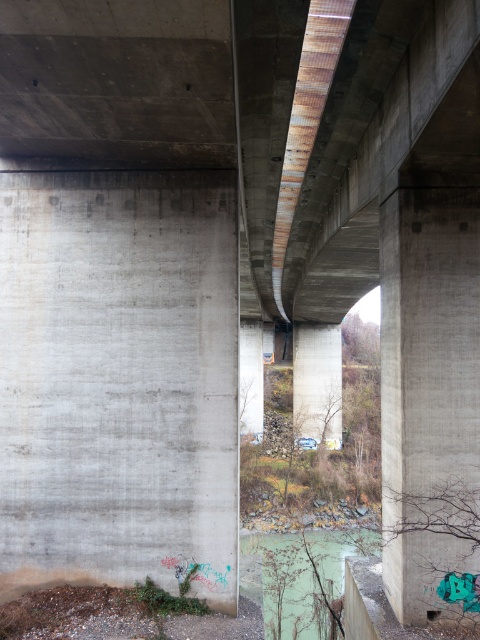
You are a GUI agent. You are given a task and a screenshot of the screen. Output one action in this format:
    pyautogui.click(x=<x>, y=<y>)
    Task: Click on the gray concrete wall at left
    
    Given the screenshot: What is the action you would take?
    pyautogui.click(x=119, y=378)

What are the coordinates of `gray concrete wall at left` in the screenshot? It's located at (119, 378).

Does gray concrete wall at left have a smaller size compared to gray concrete pillar at center?

Yes.

What are the coordinates of `gray concrete wall at left` in the screenshot? It's located at (119, 378).

At what (x,y) coordinates should I click in order to perform the action: click on gray concrete wall at left. Please return your answer as a coordinate pair (x, y). The height and width of the screenshot is (640, 480). Looking at the image, I should click on coord(119,378).

Between concrete/rough pillar at right and rusty metal pillar at center, which one has less height?

concrete/rough pillar at right is shorter.

Who is positioned more to the left, concrete/rough pillar at right or rusty metal pillar at center?

concrete/rough pillar at right is more to the left.

At what (x,y) coordinates should I click in order to perform the action: click on concrete/rough pillar at right. Please return your answer as a coordinate pair (x, y). This screenshot has height=640, width=480. Looking at the image, I should click on (428, 381).